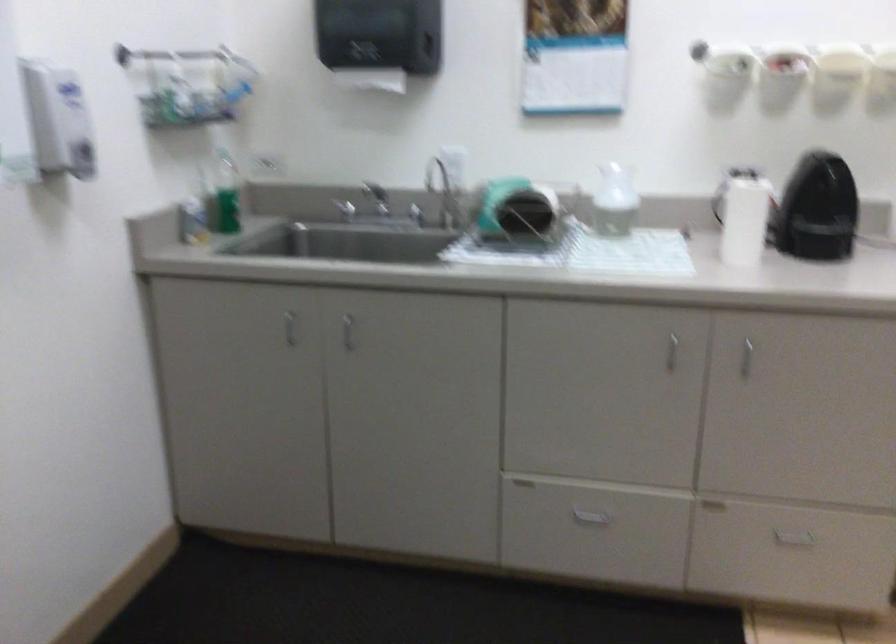
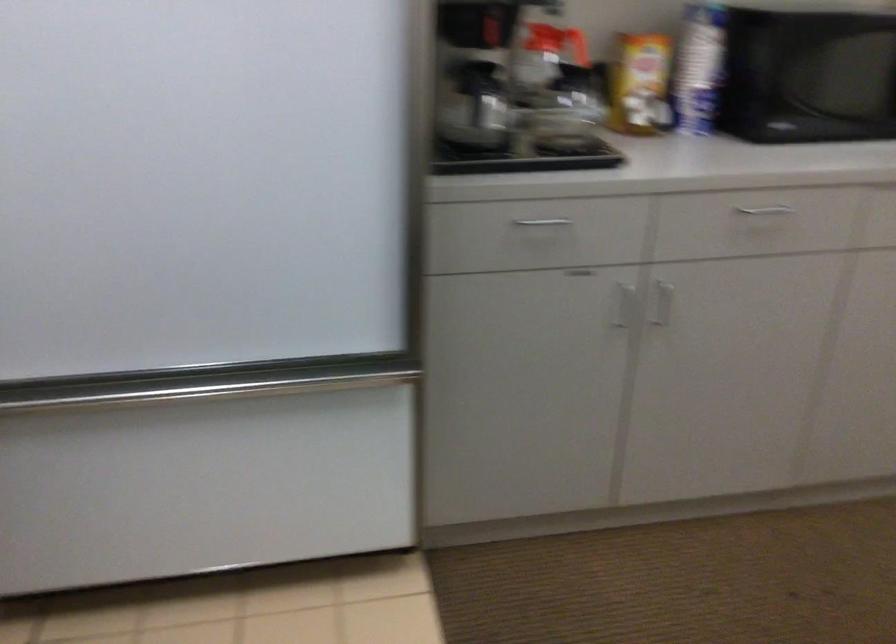
The first image is from the beginning of the video and the second image is from the end. How did the camera likely rotate when shooting the video?

The camera rotated toward right-down.